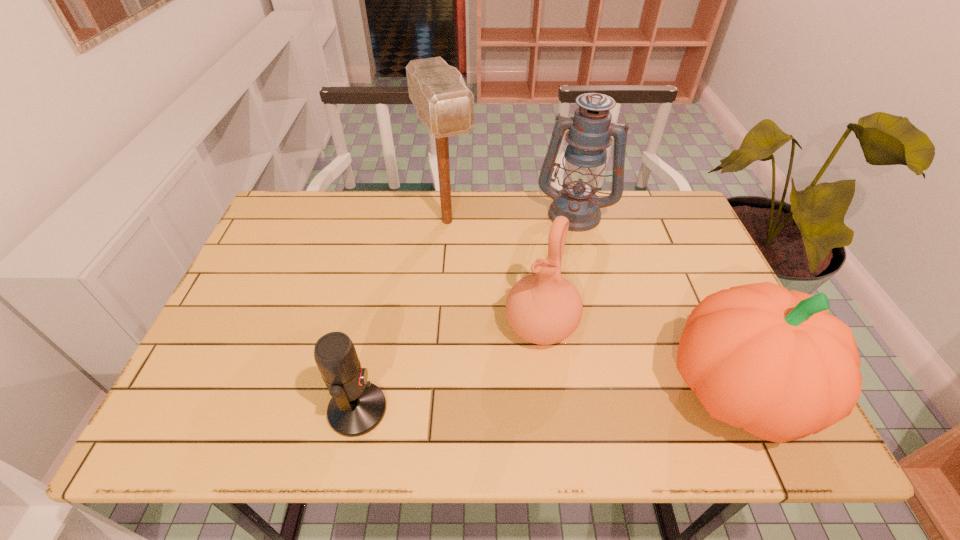
At what (x,y) coordinates should I click in order to perform the action: click on free space located on the front-facing side of the second tallest object. Please return your answer as a coordinate pair (x, y). The image size is (960, 540). Looking at the image, I should click on (550, 285).

Find the location of a particular element. This screenshot has height=540, width=960. blank area located 0.140m on the front-facing side of the second tallest object is located at coordinates (557, 262).

You are a GUI agent. You are given a task and a screenshot of the screen. Output one action in this format:
    pyautogui.click(x=<x>, y=<y>)
    Task: Click on the vacant space situated 0.330m on the front-facing side of the second tallest object
    
    Given the screenshot: What is the action you would take?
    pyautogui.click(x=541, y=313)

Image resolution: width=960 pixels, height=540 pixels. Find the location of `vacant space located on the spout of the pottery`. vacant space located on the spout of the pottery is located at coordinates (499, 394).

Where is `vacant space situated 0.080m on the spout of the pottery`? The width and height of the screenshot is (960, 540). vacant space situated 0.080m on the spout of the pottery is located at coordinates (508, 380).

Where is `mallet at the far edge`? The height and width of the screenshot is (540, 960). mallet at the far edge is located at coordinates 443,102.

You are a GUI agent. You are given a task and a screenshot of the screen. Output one action in this format:
    pyautogui.click(x=<x>, y=<y>)
    Task: Click on the lantern that is at the far edge
    
    Given the screenshot: What is the action you would take?
    (590, 130)

Find the location of a particular element. microphone situated at the near edge is located at coordinates (357, 406).

This screenshot has height=540, width=960. What are the coordinates of `pumpkin situated at the near edge` in the screenshot? It's located at (759, 357).

Identify the location of object located in the right edge section of the desktop. (759, 357).